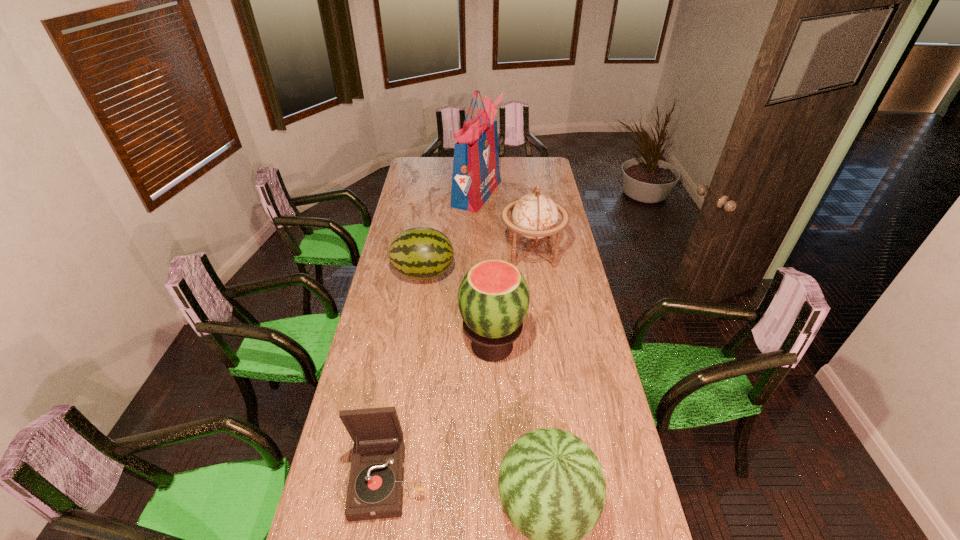
Identify the location of vacant space at the far right corner of the desktop. [544, 159].

Locate an element on the screen. This screenshot has width=960, height=540. vacant area between the phonograph record and the globe is located at coordinates (460, 366).

What are the coordinates of `free point between the grocery bag and the leftmost watermelon` in the screenshot? It's located at tap(450, 233).

Where is `unoccupied position between the farthest watermelon and the phonograph record`? The height and width of the screenshot is (540, 960). unoccupied position between the farthest watermelon and the phonograph record is located at coordinates (406, 376).

You are a GUI agent. You are given a task and a screenshot of the screen. Output one action in this format:
    pyautogui.click(x=<x>, y=<y>)
    Task: Click on the vacant space that's between the farthest watermelon and the tallest object
    This screenshot has height=540, width=960.
    Given the screenshot: What is the action you would take?
    pyautogui.click(x=450, y=233)

Find the location of `vacant area that lies between the phonograph record and the grocery bag`. vacant area that lies between the phonograph record and the grocery bag is located at coordinates (433, 336).

I want to click on object that is the fifth closest to the farthest watermelon, so click(552, 488).

What are the coordinates of `the third closest object relative to the nearest watermelon` in the screenshot? It's located at (421, 253).

Identify which watermelon is located as the second nearest to the tallest object. Please provide its 2D coordinates. Your answer should be formatted as a tuple, i.e. [(x, y)], where the tuple contains the x and y coordinates of a point satisfying the conditions above.

[(493, 298)]

Identify the location of the second closest watermelon to the third nearest object. The width and height of the screenshot is (960, 540). (552, 488).